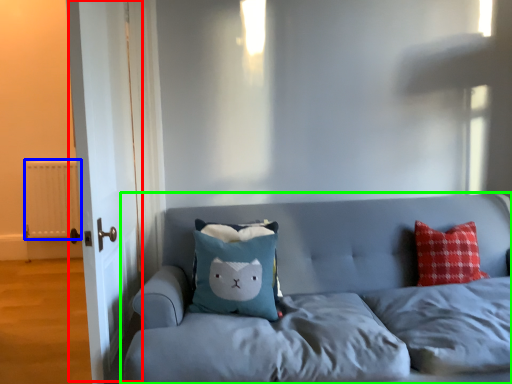
Question: Estimate the real-world distances between objects in this image. Which object is farther from door (highlighted by a red box), radiator (highlighted by a blue box) or studio couch (highlighted by a green box)?

Choices:
 (A) radiator
 (B) studio couch

Answer: (A)